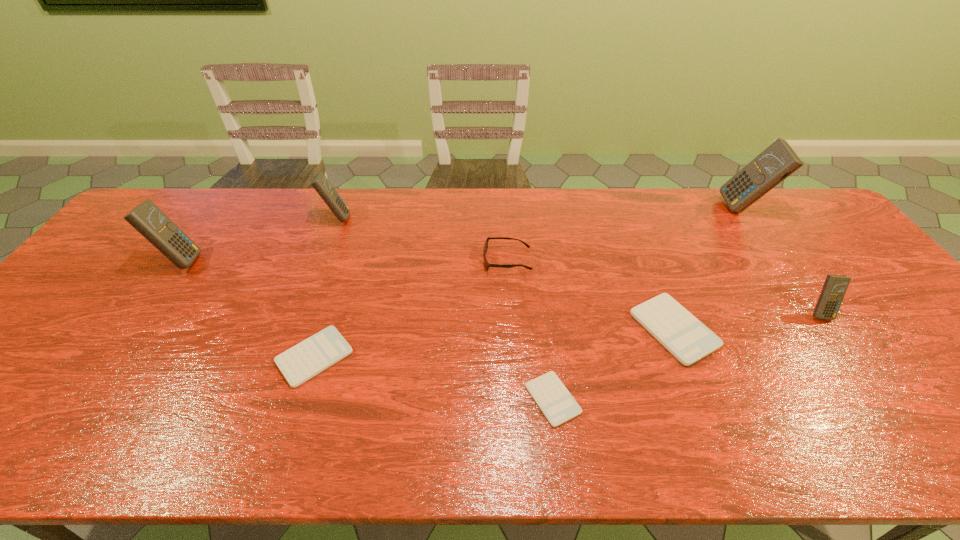
This screenshot has height=540, width=960. What are the coordinates of `free space between the biggest blue calculator and the smallest blue calculator` in the screenshot? It's located at (781, 260).

You are a GUI agent. You are given a task and a screenshot of the screen. Output one action in this format:
    pyautogui.click(x=<x>, y=<y>)
    Task: Click on the empty space that is in between the tallest calculator and the leftmost calculator
    
    Given the screenshot: What is the action you would take?
    pyautogui.click(x=463, y=234)

You are a GUI agent. You are given a task and a screenshot of the screen. Output one action in this format:
    pyautogui.click(x=<x>, y=<y>)
    Task: Click on the vacant space that is in between the second smallest white calculator and the smallest white calculator
    
    Given the screenshot: What is the action you would take?
    pyautogui.click(x=434, y=378)

Identify the location of object that is the fourth nearest to the tallest calculator. This screenshot has height=540, width=960. (557, 404).

Identify which object is located as the fourth nearest to the fourth calculator from left to right. Please provide its 2D coordinates. Your answer should be formatted as a tuple, i.e. [(x, y)], where the tuple contains the x and y coordinates of a point satisfying the conditions above.

[(835, 286)]

Point out which calculator is positioned as the second nearest to the leftmost blue calculator. Please provide its 2D coordinates. Your answer should be formatted as a tuple, i.e. [(x, y)], where the tuple contains the x and y coordinates of a point satisfying the conditions above.

[(310, 357)]

The height and width of the screenshot is (540, 960). I want to click on calculator identified as the sixth closest to the second biggest white calculator, so click(778, 161).

Where is `blue calculator that stands as the closest to the biggest blue calculator`? blue calculator that stands as the closest to the biggest blue calculator is located at coordinates (835, 286).

Locate an element on the screen. Image resolution: width=960 pixels, height=540 pixels. blue calculator that can be found as the third closest to the seventh tallest object is located at coordinates (835, 286).

Where is `white calculator that is the second closest to the smallest white calculator`? Image resolution: width=960 pixels, height=540 pixels. white calculator that is the second closest to the smallest white calculator is located at coordinates (310, 357).